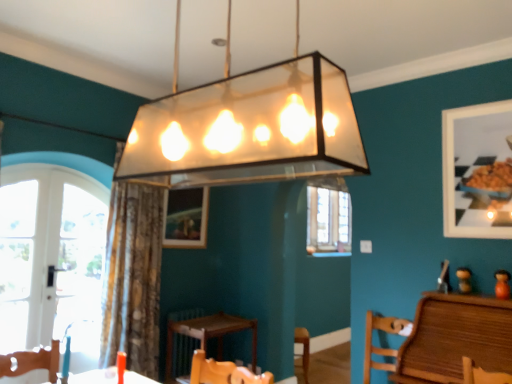
What is the approximate height of translucent glass pendant light at center?

It is 27.35 inches.

I want to click on wooden picture frame at center, which is counted as the 1th picture frame, starting from the back, so click(186, 218).

The image size is (512, 384). What are the coordinates of `wooden table at center` in the screenshot? It's located at (208, 335).

Locate an element on the screen. Image resolution: width=512 pixels, height=384 pixels. white glass door at left is located at coordinates (64, 246).

The image size is (512, 384). Describe the element at coordinates (64, 246) in the screenshot. I see `white glass door at left` at that location.

Locate an element on the screen. The width and height of the screenshot is (512, 384). translucent glass pendant light at center is located at coordinates (248, 128).

Who is bigger, wooden table at center or matte white picture frame at upper right, positioned as the 2th picture frame in back-to-front order?

wooden table at center is bigger.

Considering the positions of objects wooden table at center and matte white picture frame at upper right, acting as the first picture frame starting from the front, in the image provided, who is in front, wooden table at center or matte white picture frame at upper right, acting as the first picture frame starting from the front,?

matte white picture frame at upper right, acting as the first picture frame starting from the front, is closer to the camera.

Is wooden table at center inside or outside of matte white picture frame at upper right, acting as the first picture frame starting from the front?

wooden table at center is located beyond the bounds of matte white picture frame at upper right, acting as the first picture frame starting from the front.

Between point (173, 345) and point (496, 139), which one is positioned behind?

The point (173, 345) is more distant.

Is wooden chair at lower right located within matte white picture frame at upper right, the second picture frame positioned from the left?

Actually, wooden chair at lower right is outside matte white picture frame at upper right, the second picture frame positioned from the left.

Which object is positioned more to the left, matte white picture frame at upper right, the second picture frame positioned from the left, or wooden chair at lower right?

From the viewer's perspective, wooden chair at lower right appears more on the left side.

Is matte white picture frame at upper right, the second picture frame positioned from the left, aimed at wooden chair at lower right?

No, matte white picture frame at upper right, the second picture frame positioned from the left, does not turn towards wooden chair at lower right.

Can you confirm if matte white picture frame at upper right, acting as the first picture frame starting from the front, is thinner than wooden chair at lower right?

Indeed, matte white picture frame at upper right, acting as the first picture frame starting from the front, has a lesser width compared to wooden chair at lower right.

Does matte white picture frame at upper right, arranged as the first picture frame when viewed from the right, have a lesser height compared to translucent glass pendant light at center?

In fact, matte white picture frame at upper right, arranged as the first picture frame when viewed from the right, may be taller than translucent glass pendant light at center.

Can you confirm if matte white picture frame at upper right, arranged as the first picture frame when viewed from the right, is positioned to the left of translucent glass pendant light at center?

No, matte white picture frame at upper right, arranged as the first picture frame when viewed from the right, is not to the left of translucent glass pendant light at center.

Would you say matte white picture frame at upper right, acting as the first picture frame starting from the front, is outside translucent glass pendant light at center?

That's correct, matte white picture frame at upper right, acting as the first picture frame starting from the front, is outside of translucent glass pendant light at center.

From a real-world perspective, does matte white picture frame at upper right, acting as the first picture frame starting from the front, stand above translucent glass pendant light at center?

No.

Which is more to the right, wooden chair at lower right or wooden table at center?

wooden chair at lower right is more to the right.

Considering the positions of point (367, 380) and point (201, 334), is point (367, 380) closer or farther from the camera than point (201, 334)?

Clearly, point (367, 380) is closer to the camera than point (201, 334).

How many degrees apart are the facing directions of wooden chair at lower right and wooden table at center?

The angle between the facing direction of wooden chair at lower right and the facing direction of wooden table at center is 92.7 degrees.

Is wooden chair at lower right touching wooden table at center?

No, wooden chair at lower right is not touching wooden table at center.

Looking at this image, which object is further away from the camera, translucent glass pendant light at center or white glass door at left?

white glass door at left.

From the image's perspective, is translucent glass pendant light at center on white glass door at left?

Yes, from the image's perspective, translucent glass pendant light at center is on top of white glass door at left.

Is point (134, 126) closer or farther from the camera than point (88, 281)?

Point (134, 126) is positioned closer to the camera compared to point (88, 281).

Considering the sizes of objects translucent glass pendant light at center and white glass door at left in the image provided, who is smaller, translucent glass pendant light at center or white glass door at left?

Smaller between the two is white glass door at left.

Is point (154, 256) closer or farther from the camera than point (466, 124)?

Point (154, 256) is positioned farther from the camera compared to point (466, 124).

Looking at this image, are brown textured curtain at center and matte white picture frame at upper right, positioned as the 2th picture frame in back-to-front order, located far from each other?

brown textured curtain at center is positioned a significant distance from matte white picture frame at upper right, positioned as the 2th picture frame in back-to-front order.

From the image's perspective, which object appears higher, brown textured curtain at center or matte white picture frame at upper right, acting as the first picture frame starting from the front?

matte white picture frame at upper right, acting as the first picture frame starting from the front.

Between brown textured curtain at center and matte white picture frame at upper right, acting as the first picture frame starting from the front, which one appears on the right side from the viewer's perspective?

matte white picture frame at upper right, acting as the first picture frame starting from the front.

Is point (204, 321) closer or farther from the camera than point (292, 61)?

Clearly, point (204, 321) is more distant from the camera than point (292, 61).

Is wooden table at center looking in the opposite direction of translucent glass pendant light at center?

That's not correct — wooden table at center is not looking away from translucent glass pendant light at center.

Considering the sizes of objects wooden table at center and translucent glass pendant light at center in the image provided, who is taller, wooden table at center or translucent glass pendant light at center?

With more height is translucent glass pendant light at center.

From a real-world perspective, is wooden table at center physically below translucent glass pendant light at center?

Correct, in the physical world, wooden table at center is lower than translucent glass pendant light at center.

The image size is (512, 384). Identify the location of table below the matte white picture frame at upper right, arranged as the first picture frame when viewed from the right (from the image's perspective). (208, 335).

Which picture frame is the 1st one when counting from the back of the wooden chair at lower right? Please provide its 2D coordinates.

[(477, 171)]

Which object lies nearer to the anchor point brown textured curtain at center, white glass door at left or wooden picture frame at center, which ranks as the first picture frame in left-to-right order?

white glass door at left.

From the image, which object appears to be nearer to wooden picture frame at center, the 2th picture frame in the right-to-left sequence, brown textured curtain at center or wooden table at center?

Based on the image, brown textured curtain at center appears to be nearer to wooden picture frame at center, the 2th picture frame in the right-to-left sequence.

Considering their positions, is brown textured curtain at center positioned further to wooden table at center than wooden picture frame at center, which is counted as the 1th picture frame, starting from the back?

wooden picture frame at center, which is counted as the 1th picture frame, starting from the back, is positioned further to the anchor wooden table at center.

Based on their spatial positions, is wooden table at center or white glass door at left further from wooden chair at lower right?

Among the two, white glass door at left is located further to wooden chair at lower right.

Based on their spatial positions, is matte white picture frame at upper right, acting as the first picture frame starting from the front, or wooden picture frame at center, the 2th picture frame in the right-to-left sequence, further from wooden table at center?

Among the two, matte white picture frame at upper right, acting as the first picture frame starting from the front, is located further to wooden table at center.

Which object lies nearer to the anchor point wooden picture frame at center, which is counted as the 1th picture frame, starting from the back, wooden table at center or translucent glass pendant light at center?

wooden table at center is closer to wooden picture frame at center, which is counted as the 1th picture frame, starting from the back.

From the image, which object appears to be farther from white glass door at left, wooden table at center or wooden chair at lower right?

wooden chair at lower right is positioned further to the anchor white glass door at left.

When comparing their distances from wooden table at center, does wooden chair at lower right or matte white picture frame at upper right, acting as the first picture frame starting from the front, seem further?

matte white picture frame at upper right, acting as the first picture frame starting from the front, is further to wooden table at center.

Where is `table between brown textured curtain at center and matte white picture frame at upper right, the second picture frame positioned from the left, from left to right`? This screenshot has width=512, height=384. table between brown textured curtain at center and matte white picture frame at upper right, the second picture frame positioned from the left, from left to right is located at coordinates (208, 335).

Locate an element on the screen. The image size is (512, 384). picture frame between white glass door at left and matte white picture frame at upper right, acting as the first picture frame starting from the front is located at coordinates (186, 218).

Identify the location of lamp located between brown textured curtain at center and matte white picture frame at upper right, positioned as the 2th picture frame in back-to-front order, in the left-right direction. Image resolution: width=512 pixels, height=384 pixels. (248, 128).

Where is `curtain between white glass door at left and matte white picture frame at upper right, arranged as the first picture frame when viewed from the right`? The height and width of the screenshot is (384, 512). curtain between white glass door at left and matte white picture frame at upper right, arranged as the first picture frame when viewed from the right is located at coordinates (133, 277).